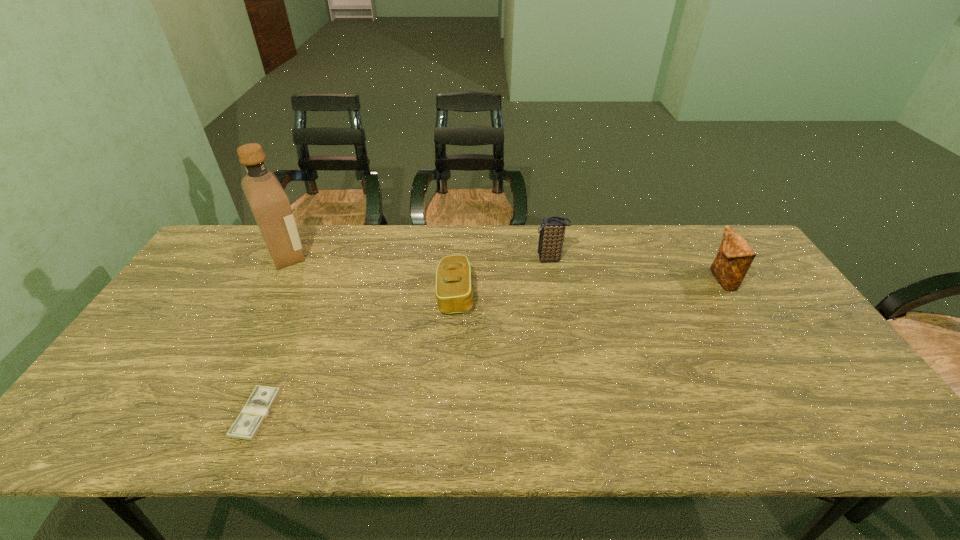
This screenshot has width=960, height=540. I want to click on vacant region between the farthest clutch bag and the leftmost object, so click(419, 256).

Identify the location of unoccupied position between the tallest object and the farthest clutch bag. The image size is (960, 540). tap(419, 256).

I want to click on free spot between the liquor and the third object from right to left, so tap(371, 274).

Find the location of a particular element. empty space that is in between the leftmost object and the third object from left to right is located at coordinates pos(371,274).

You are a GUI agent. You are given a task and a screenshot of the screen. Output one action in this format:
    pyautogui.click(x=<x>, y=<y>)
    Task: Click on the free point between the second object from left to right and the third object from right to left
    The width and height of the screenshot is (960, 540).
    Given the screenshot: What is the action you would take?
    [x=356, y=354]

The height and width of the screenshot is (540, 960). Find the location of `vacant area that lies between the nearest object and the rightmost clutch bag`. vacant area that lies between the nearest object and the rightmost clutch bag is located at coordinates click(490, 347).

At what (x,y) coordinates should I click in order to perform the action: click on free space between the second clutch bag from left to right and the leftmost clutch bag. Please return your answer as a coordinate pair (x, y). The image size is (960, 540). Looking at the image, I should click on (503, 277).

Where is `object that is the fourth nearest to the liquor`? object that is the fourth nearest to the liquor is located at coordinates (735, 256).

Select which object is the closest to the shortest clutch bag. Please provide its 2D coordinates. Your answer should be formatted as a tuple, i.e. [(x, y)], where the tuple contains the x and y coordinates of a point satisfying the conditions above.

[(552, 229)]

Point out which clutch bag is positioned as the second nearest to the shortest clutch bag. Please provide its 2D coordinates. Your answer should be formatted as a tuple, i.e. [(x, y)], where the tuple contains the x and y coordinates of a point satisfying the conditions above.

[(735, 256)]